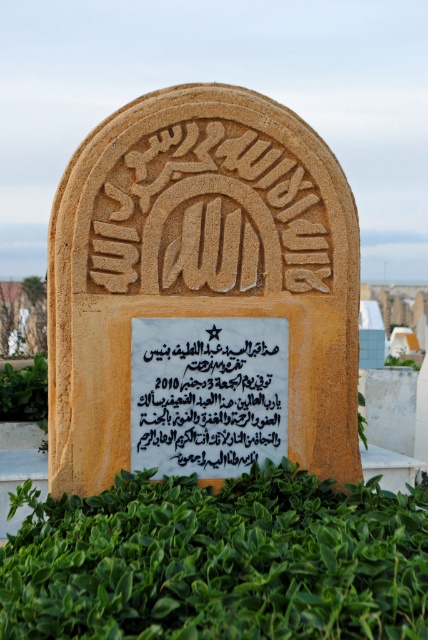
You are a gardener who needs to trim the green leafy hedge at lower center without damaging the sandstone gravestone at center. Can you safely trim the hedge if your shears have a maximum reach of 22 inches?

The distance between the sandstone gravestone at center and the green leafy hedge at lower center is 24.05 inches. Since your shears can only reach 22 inches, you cannot safely trim the hedge without potentially damaging the gravestone.

Based on the photo, you are a historian examining the tombstone and notice a point marked at coordinates (208, 394). What object on the tombstone is located at this point?

The black paper text at center is located at point (208, 394).